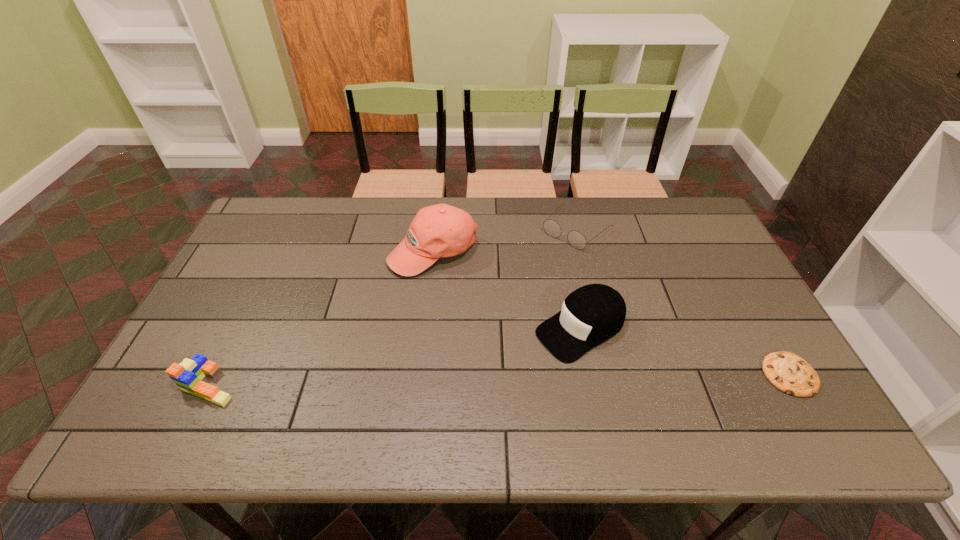
This screenshot has height=540, width=960. What are the coordinates of `blank space located on the temples of the spectacles` in the screenshot? It's located at (511, 292).

The height and width of the screenshot is (540, 960). I want to click on free space located on the temples of the spectacles, so pyautogui.click(x=541, y=262).

Locate an element on the screen. This screenshot has width=960, height=540. free point located on the front-facing side of the baseball cap is located at coordinates (427, 366).

This screenshot has width=960, height=540. Find the location of `vacant area situated on the front-facing side of the baseball cap`. vacant area situated on the front-facing side of the baseball cap is located at coordinates (426, 383).

This screenshot has width=960, height=540. What are the coordinates of `vacant space located on the front-facing side of the baseball cap` in the screenshot? It's located at (428, 336).

Image resolution: width=960 pixels, height=540 pixels. What are the coordinates of `vacant space located on the front-facing side of the cap` in the screenshot? It's located at (526, 359).

Image resolution: width=960 pixels, height=540 pixels. In order to click on free space located on the front-facing side of the cap in this screenshot , I will do `click(520, 363)`.

The height and width of the screenshot is (540, 960). Identify the location of blank space located on the front-facing side of the cap. click(480, 387).

Find the location of `spectacles that is at the far edge`. spectacles that is at the far edge is located at coordinates (576, 239).

Where is `baseball cap present at the far edge`? Image resolution: width=960 pixels, height=540 pixels. baseball cap present at the far edge is located at coordinates (441, 230).